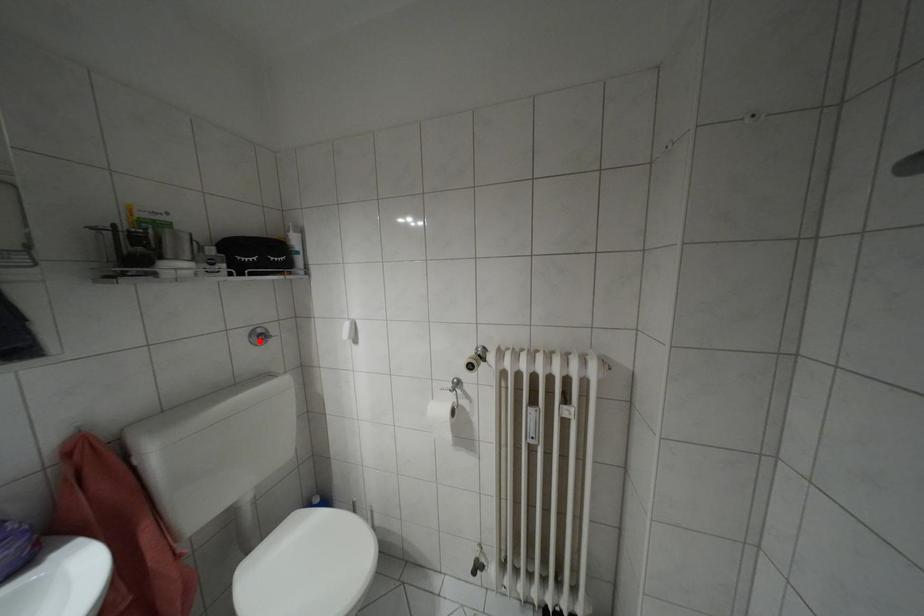
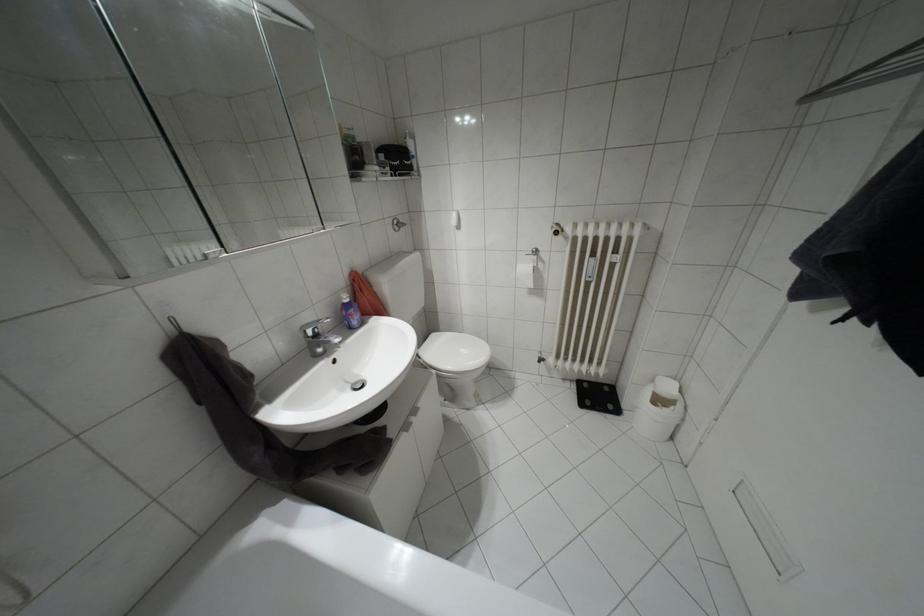
The point at the highlighted location is marked in the first image. Where is the corresponding point in the second image?

(395, 229)